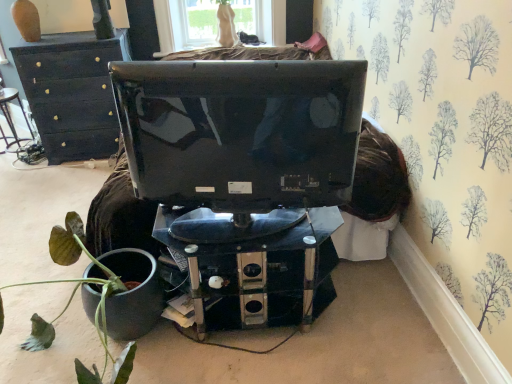
Question: Choose the correct answer: Is black wood dresser at upper left inside transparent glass window at upper center or outside it?

Choices:
 (A) inside
 (B) outside

Answer: (B)

Question: Is black wood dresser at upper left to the left or to the right of transparent glass window at upper center in the image?

Choices:
 (A) left
 (B) right

Answer: (A)

Question: Considering the real-world distances, which object is farthest from the metallic silver chair at left?

Choices:
 (A) glossy black monitor at center
 (B) transparent glass window at upper center
 (C) black wood dresser at upper left
 (D) metallic black computer desk at center
 (E) green matte plant pot at lower left

Answer: (D)

Question: Based on their relative distances, which object is farther from the green matte plant pot at lower left?

Choices:
 (A) metallic black computer desk at center
 (B) black wood dresser at upper left
 (C) glossy black monitor at center
 (D) metallic silver chair at left
 (E) transparent glass window at upper center

Answer: (E)